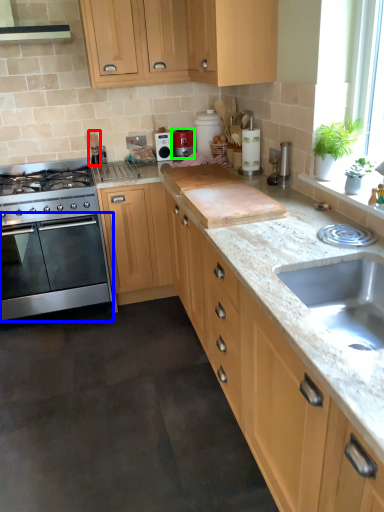
Question: Considering the real-world distances, which object is farthest from appliance (highlighted by a red box)? oven (highlighted by a blue box) or kitchen appliance (highlighted by a green box)?

Choices:
 (A) oven
 (B) kitchen appliance

Answer: (A)